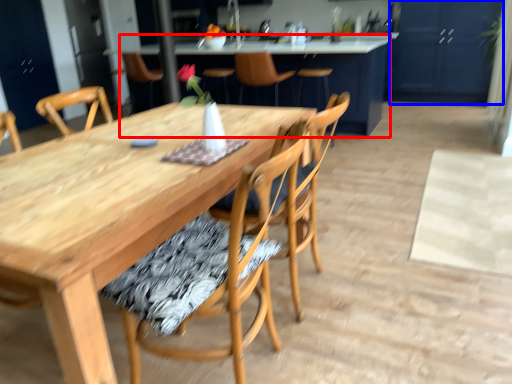
Question: Which point is closer to the camera, table (highlighted by a red box) or cabinetry (highlighted by a blue box)?

Choices:
 (A) table
 (B) cabinetry

Answer: (A)